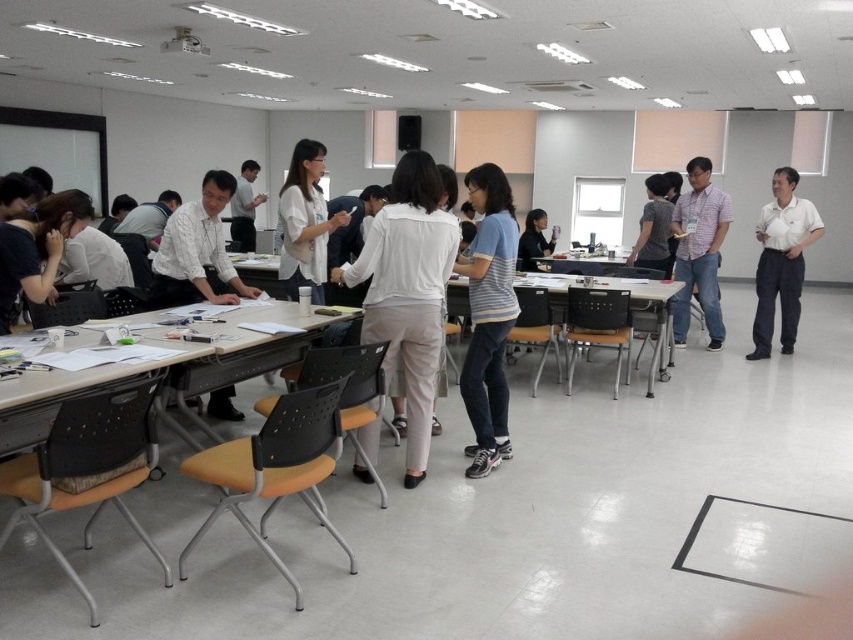
Based on the photo, you are a photographer standing in the classroom. You want to take a photo of the wooden table at center without the white smooth shirt at right appearing in the frame. Is this possible based on their positions?

The wooden table at center is positioned under the white smooth shirt at right, so the shirt would block part of the table in the photo unless you adjust your angle or move the objects.

You are standing at the back of the classroom and want to reach the point marked as point (x=785, y=284). There is an obstacle at point (x=556, y=272). Will you encounter the obstacle before reaching your destination?

Point (x=785, y=284) is in front of point (x=556, y=272), so you will reach the destination before encountering the obstacle.